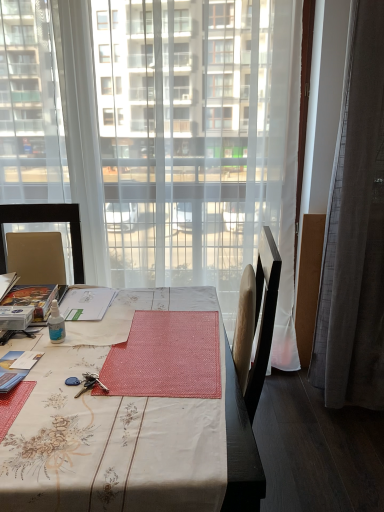
Question: From the image's perspective, is transparent plastic bottle at table center located above or below transparent curtain at center?

Choices:
 (A) above
 (B) below

Answer: (B)

Question: Is transparent plastic bottle at table center in front of or behind transparent curtain at center in the image?

Choices:
 (A) front
 (B) behind

Answer: (A)

Question: Which object is positioned farthest from the transparent curtain at center?

Choices:
 (A) gray fabric curtain at right
 (B) floral-patterned fabric desk at center
 (C) transparent plastic bottle at table center

Answer: (C)

Question: Estimate the real-world distances between objects in this image. Which object is closer to the floral-patterned fabric desk at center?

Choices:
 (A) transparent plastic bottle at table center
 (B) transparent curtain at center
 (C) gray fabric curtain at right

Answer: (A)